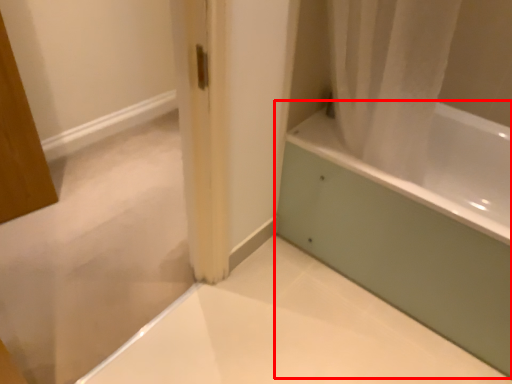
Question: From the image's perspective, considering the relative positions of bathtub (annotated by the red box) and bath in the image provided, where is bathtub (annotated by the red box) located with respect to the staircase?

Choices:
 (A) below
 (B) above

Answer: (A)